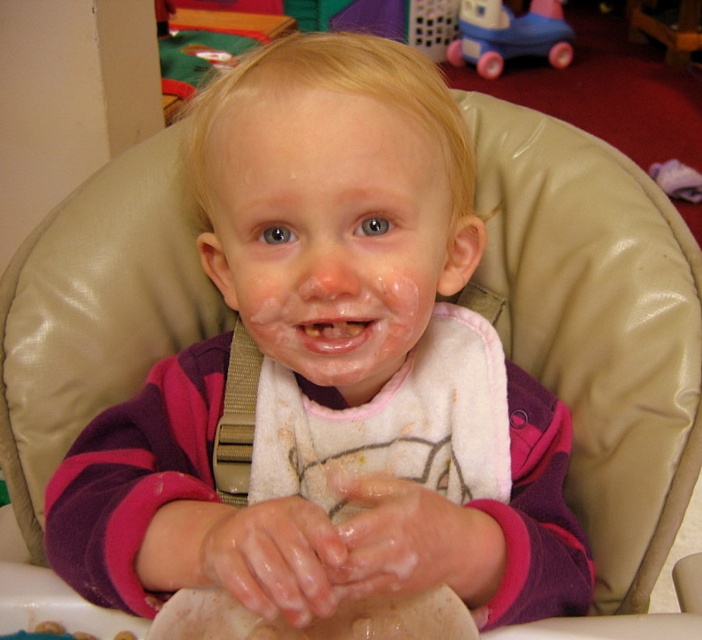
You are a parent trying to dress your child who is currently wearing the white matte bib at center and the pink fleece sweater at center. Which item should you remove first to avoid making a mess on the other clothing?

You should remove the white matte bib at center first because it is smaller and located under the pink fleece sweater at center, so taking it off first will prevent the sweater from getting soiled further.

Based on the photo, the child in the high chair has a white bib with a patterned design and is surrounded by colorful toys. You are a parent trying to decide whether to place the matte plastic toy car at upper right into the child mouth. Based on their current position, will the toy car be above or below the yellowish matte teeth at center?

The matte plastic toy car at upper right is above the yellowish matte teeth at center, so placing it into the child mouth would require moving it downward.